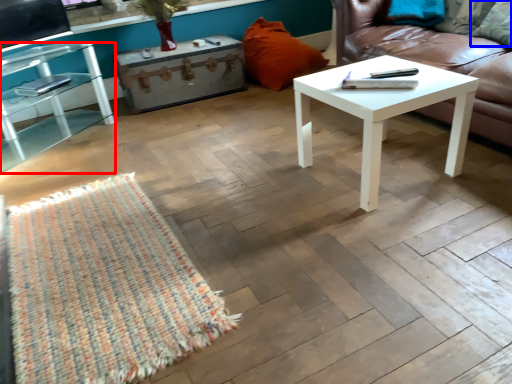
Question: Which point is closer to the camera, table (highlighted by a red box) or pillow (highlighted by a blue box)?

Choices:
 (A) table
 (B) pillow

Answer: (A)